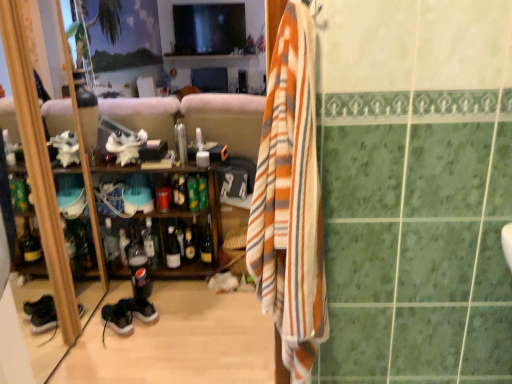
At what (x,y) coordinates should I click in order to perform the action: click on matte glass bottle at center, the 6th bottle in the right-to-left sequence. Please return your answer as a coordinate pair (x, y). Looking at the image, I should click on (151, 244).

Measure the distance between matte glass bottle at center, the 6th bottle in the right-to-left sequence, and camera.

2.42 meters.

Describe the element at coordinates (138, 266) in the screenshot. I see `matte plastic soda bottle at center, placed as the seventh bottle when sorted from right to left` at that location.

Locate an element on the screen. Image resolution: width=512 pixels, height=384 pixels. matte plastic soda bottle at center, placed as the seventh bottle when sorted from right to left is located at coordinates (138, 266).

How much space does translucent glass bottle at center, marked as the 5th bottle in a right-to-left arrangement, occupy vertically?

translucent glass bottle at center, marked as the 5th bottle in a right-to-left arrangement, is 11.90 inches tall.

Describe the element at coordinates (172, 249) in the screenshot. I see `translucent glass bottle at center, marked as the 5th bottle in a right-to-left arrangement` at that location.

You are a GUI agent. You are given a task and a screenshot of the screen. Output one action in this format:
    pyautogui.click(x=<x>, y=<y>)
    Task: Click on the translucent glass bottle at center, which ranks as the 9th bottle in right-to-left order
    
    Given the screenshot: What is the action you would take?
    click(111, 247)

Is point (116, 250) more distant than point (244, 36)?

That is False.

Which is more to the left, translucent glass bottle at center, the first bottle viewed from the left, or flat screen tv at upper center?

From the viewer's perspective, translucent glass bottle at center, the first bottle viewed from the left, appears more on the left side.

From the image's perspective, between translucent glass bottle at center, which ranks as the 9th bottle in right-to-left order, and flat screen tv at upper center, which one is located above?

flat screen tv at upper center, from the image's perspective.

At what (x,y) coordinates should I click in order to perform the action: click on the 5th bottle below the flat screen tv at upper center (from the image's perspective). Please return your answer as a coordinate pair (x, y). The height and width of the screenshot is (384, 512). Looking at the image, I should click on (111, 247).

Is wooden cabinet at left closer to camera compared to transparent plastic faucet at center?

Yes, wooden cabinet at left is closer to the camera.

Is transparent plastic faucet at center at the back of wooden cabinet at left?

No, wooden cabinet at left is not facing the opposite direction of transparent plastic faucet at center.

Can we say wooden cabinet at left lies outside transparent plastic faucet at center?

Indeed, wooden cabinet at left is completely outside transparent plastic faucet at center.

Which point is more distant from viewer, (x=11, y=42) or (x=178, y=145)?

Point (x=178, y=145)

Considering the points (125, 232) and (21, 94), which point is behind, point (125, 232) or point (21, 94)?

The point (125, 232) is farther from the camera.

Is translucent plastic bottle at center, arranged as the eighth bottle when viewed from the right, in contact with wooden cabinet at left?

translucent plastic bottle at center, arranged as the eighth bottle when viewed from the right, is not next to wooden cabinet at left, and they're not touching.

From a real-world perspective, between translucent plastic bottle at center, which appears as the 2th bottle when viewed from the left, and wooden cabinet at left, who is vertically higher?

wooden cabinet at left.

Does green glass bottle at center, positioned as the eighth bottle in left-to-right order, touch matte glass bottle at center, which appears as the sixth bottle when viewed from the left?

Yes, green glass bottle at center, positioned as the eighth bottle in left-to-right order, is beside matte glass bottle at center, which appears as the sixth bottle when viewed from the left.

Would you say green glass bottle at center, which appears as the 2th bottle when viewed from the right, is outside matte glass bottle at center, which is the fourth bottle from right to left?

Yes, green glass bottle at center, which appears as the 2th bottle when viewed from the right, is located beyond the bounds of matte glass bottle at center, which is the fourth bottle from right to left.

Can you confirm if green glass bottle at center, which appears as the 2th bottle when viewed from the right, is taller than matte glass bottle at center, which appears as the sixth bottle when viewed from the left?

In fact, green glass bottle at center, which appears as the 2th bottle when viewed from the right, may be shorter than matte glass bottle at center, which appears as the sixth bottle when viewed from the left.

From a real-world perspective, who is located lower, green glass bottle at center, which appears as the 2th bottle when viewed from the right, or matte glass bottle at center, which appears as the sixth bottle when viewed from the left?

From a 3D spatial view, green glass bottle at center, which appears as the 2th bottle when viewed from the right, is below.

Could you measure the distance between translucent plastic bottle at center, arranged as the eighth bottle when viewed from the right, and shiny gold bottle at center, the ninth bottle viewed from the left?

translucent plastic bottle at center, arranged as the eighth bottle when viewed from the right, and shiny gold bottle at center, the ninth bottle viewed from the left, are 47.39 centimeters apart from each other.

Who is smaller, translucent plastic bottle at center, which appears as the 2th bottle when viewed from the left, or shiny gold bottle at center, the 1th bottle from the right?

Smaller between the two is translucent plastic bottle at center, which appears as the 2th bottle when viewed from the left.

From a real-world perspective, is translucent plastic bottle at center, arranged as the eighth bottle when viewed from the right, positioned above or below shiny gold bottle at center, the 1th bottle from the right?

translucent plastic bottle at center, arranged as the eighth bottle when viewed from the right, is situated lower than shiny gold bottle at center, the 1th bottle from the right, in the real world.

From the image's perspective, is wooden shelf at center located above translucent plastic bottle at center, arranged as the eighth bottle when viewed from the right?

Yes, from the image's perspective, wooden shelf at center is above translucent plastic bottle at center, arranged as the eighth bottle when viewed from the right.

Can you confirm if wooden shelf at center is thinner than translucent plastic bottle at center, arranged as the eighth bottle when viewed from the right?

No.

From a real-world perspective, is wooden shelf at center on top of translucent plastic bottle at center, which appears as the 2th bottle when viewed from the left?

Yes, from a real-world perspective, wooden shelf at center is on top of translucent plastic bottle at center, which appears as the 2th bottle when viewed from the left.

Measure the distance between wooden shelf at center and translucent plastic bottle at center, arranged as the eighth bottle when viewed from the right.

They are 16.83 inches apart.

Is transparent plastic faucet at center not within flat screen tv at upper center?

Yes.

From the image's perspective, between transparent plastic faucet at center and flat screen tv at upper center, who is located below?

transparent plastic faucet at center.

In the scene shown: Are transparent plastic faucet at center and flat screen tv at upper center located far from each other?

Yes, transparent plastic faucet at center and flat screen tv at upper center are quite far apart.

Locate an element on the screen. television above the translucent glass bottle at center, the first bottle viewed from the left (from a real-world perspective) is located at coordinates (209, 28).

I want to click on cabinetry below the transparent plastic faucet at center (from a real-world perspective), so click(x=39, y=169).

Considering their positions, is flat screen tv at upper center positioned further to translucent plastic bottle at center, arranged as the eighth bottle when viewed from the right, than wooden cabinet at left?

flat screen tv at upper center.

Which object lies further to the anchor point translucent plastic bottle at center, which appears as the 2th bottle when viewed from the left, wooden shelf at center or matte glass bottle at center, which appears as the sixth bottle when viewed from the left?

Among the two, matte glass bottle at center, which appears as the sixth bottle when viewed from the left, is located further to translucent plastic bottle at center, which appears as the 2th bottle when viewed from the left.

Based on their spatial positions, is translucent glass bottle at center, the first bottle viewed from the left, or wooden shelf at center further from matte glass bottle at center, placed as the fourth bottle when sorted from left to right?

The object further to matte glass bottle at center, placed as the fourth bottle when sorted from left to right, is translucent glass bottle at center, the first bottle viewed from the left.

Considering their positions, is wooden shelf at center positioned further to shiny dark glass bottle at center, acting as the third bottle starting from the right, than transparent plastic faucet at center?

transparent plastic faucet at center.

Consider the image. Which object lies nearer to the anchor point flat screen tv at upper center, translucent plastic bottle at center, arranged as the eighth bottle when viewed from the right, or shiny dark glass bottle at center, acting as the third bottle starting from the right?

translucent plastic bottle at center, arranged as the eighth bottle when viewed from the right.

When comparing their distances from translucent glass bottle at center, marked as the 5th bottle in a right-to-left arrangement, does matte glass bottle at center, placed as the fourth bottle when sorted from left to right, or shiny dark glass bottle at center, which appears as the 7th bottle when viewed from the left, seem further?

matte glass bottle at center, placed as the fourth bottle when sorted from left to right, is positioned further to the anchor translucent glass bottle at center, marked as the 5th bottle in a right-to-left arrangement.

From the image, which object appears to be farther from matte glass bottle at center, which is the fourth bottle from right to left, wooden cabinet at left or translucent glass bottle at center, the first bottle viewed from the left?

wooden cabinet at left is further to matte glass bottle at center, which is the fourth bottle from right to left.

From the image, which object appears to be nearer to wooden shelf at center, matte glass bottle at center, which appears as the sixth bottle when viewed from the left, or shiny dark glass bottle at center, which appears as the 7th bottle when viewed from the left?

matte glass bottle at center, which appears as the sixth bottle when viewed from the left.

Locate an element on the screen. The height and width of the screenshot is (384, 512). cabinetry between striped cotton towel at right and shiny gold bottle at center, the ninth bottle viewed from the left, along the z-axis is located at coordinates (39, 169).

Find the location of a particular element. The height and width of the screenshot is (384, 512). faucet located between striped cotton towel at right and shiny dark glass bottle at center, acting as the third bottle starting from the right, in the depth direction is located at coordinates (181, 142).

Locate an element on the screen. This screenshot has width=512, height=384. shelf between green glass bottle at center, positioned as the eighth bottle in left-to-right order, and suede black shoe at lower left from top to bottom is located at coordinates pyautogui.click(x=181, y=219).

Where is `faucet between striped cotton towel at right and matte plastic soda bottle at center, placed as the seventh bottle when sorted from right to left, from front to back`? This screenshot has width=512, height=384. faucet between striped cotton towel at right and matte plastic soda bottle at center, placed as the seventh bottle when sorted from right to left, from front to back is located at coordinates (181, 142).